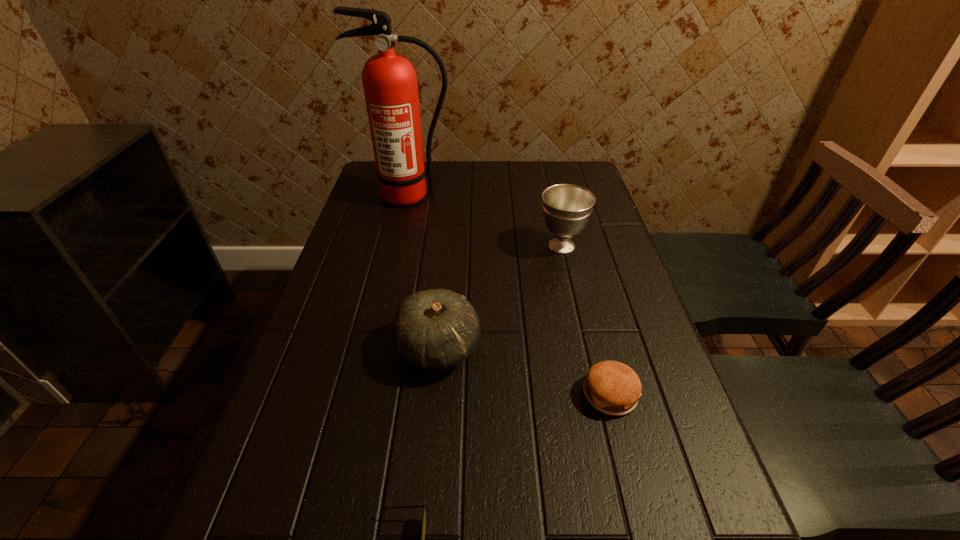
The image size is (960, 540). Identify the location of object that is at the left edge. (389, 80).

Locate an element on the screen. Image resolution: width=960 pixels, height=540 pixels. chalice at the right edge is located at coordinates (566, 208).

Locate an element on the screen. This screenshot has width=960, height=540. hamburger located at the right edge is located at coordinates (612, 387).

Image resolution: width=960 pixels, height=540 pixels. I want to click on object located in the far left corner section of the desktop, so click(x=389, y=80).

Locate an element on the screen. This screenshot has height=540, width=960. vacant space at the far edge of the desktop is located at coordinates (452, 180).

In the image, there is a desktop. Identify the location of vacant space at the left edge. The height and width of the screenshot is (540, 960). (257, 476).

Find the location of a particular element. free spot at the right edge of the desktop is located at coordinates (597, 213).

You are a GUI agent. You are given a task and a screenshot of the screen. Output one action in this format:
    pyautogui.click(x=<x>, y=<y>)
    Task: Click on the vacant point located between the hamburger and the gourd
    
    Given the screenshot: What is the action you would take?
    pyautogui.click(x=524, y=372)

The width and height of the screenshot is (960, 540). Identify the location of free space between the fourth tallest object and the gourd. (524, 372).

Find the location of a particular element. The width and height of the screenshot is (960, 540). vacant region between the gourd and the second farthest object is located at coordinates (500, 297).